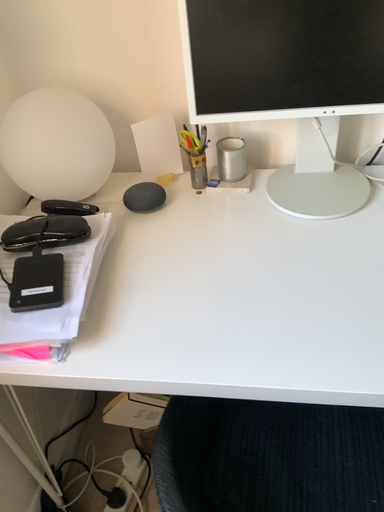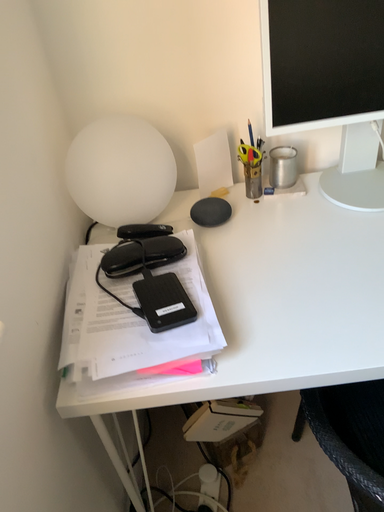
Question: How did the camera likely rotate when shooting the video?

Choices:
 (A) rotated left
 (B) rotated right

Answer: (B)